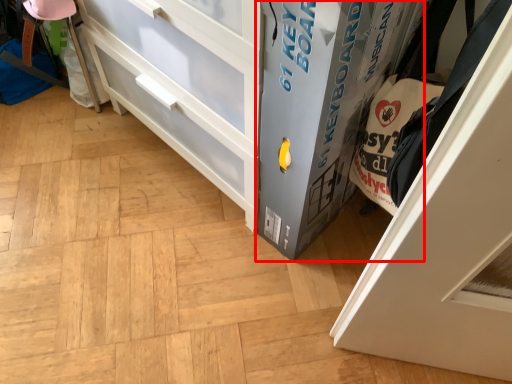
Question: Considering the relative positions of cabinetry (annotated by the red box) and door in the image provided, where is cabinetry (annotated by the red box) located with respect to the staircase?

Choices:
 (A) left
 (B) right

Answer: (A)